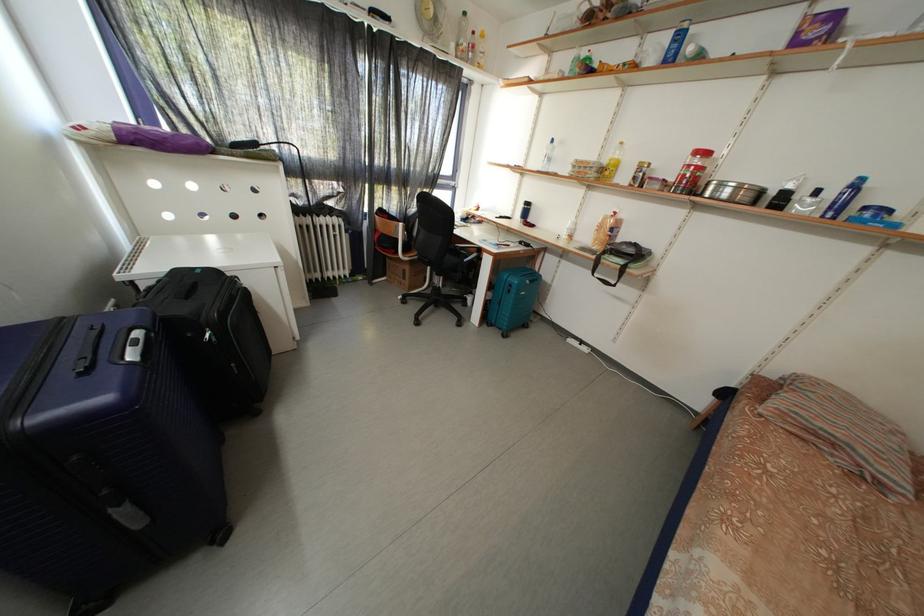
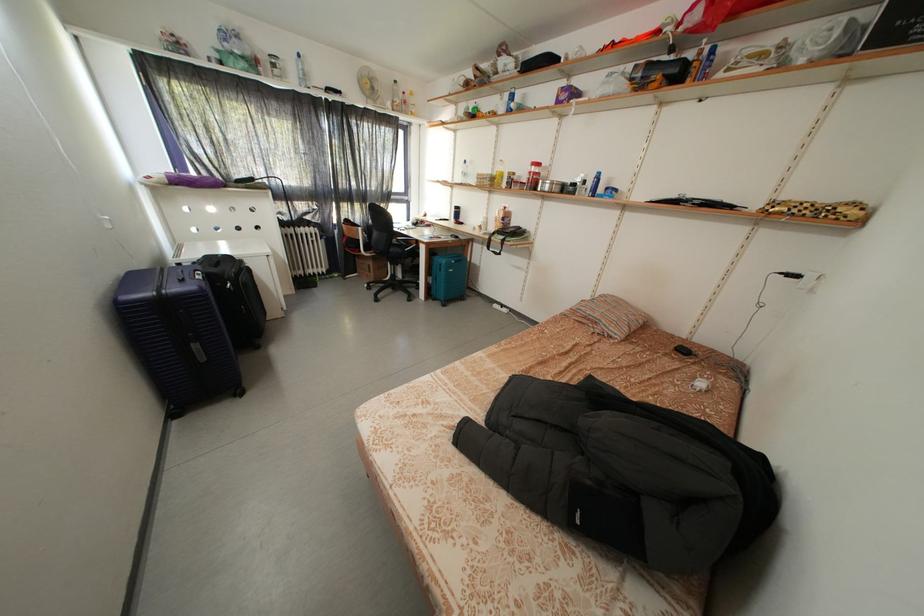
In the second image, find the point that corresponds to (x=147, y=530) in the first image.

(211, 363)